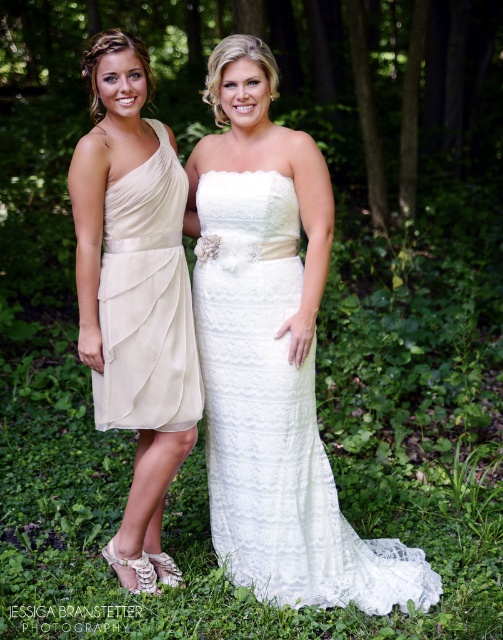
Question: Does lace/embroidered dress at center lie in front of ivory lace dress at center?

Choices:
 (A) no
 (B) yes

Answer: (A)

Question: Among these points, which one is farthest from the camera?

Choices:
 (A) (134, 410)
 (B) (177, 234)
 (C) (406, 593)

Answer: (B)

Question: Considering the real-world distances, which object is closest to the lace/embroidered dress at center?

Choices:
 (A) ivory satin dress at left
 (B) ivory lace dress at center

Answer: (A)

Question: Does lace/embroidered dress at center have a lesser width compared to ivory satin dress at left?

Choices:
 (A) yes
 (B) no

Answer: (B)

Question: Can you confirm if lace/embroidered dress at center is thinner than ivory lace dress at center?

Choices:
 (A) yes
 (B) no

Answer: (B)

Question: Which object is positioned closest to the ivory satin dress at left?

Choices:
 (A) ivory lace dress at center
 (B) lace/embroidered dress at center

Answer: (A)